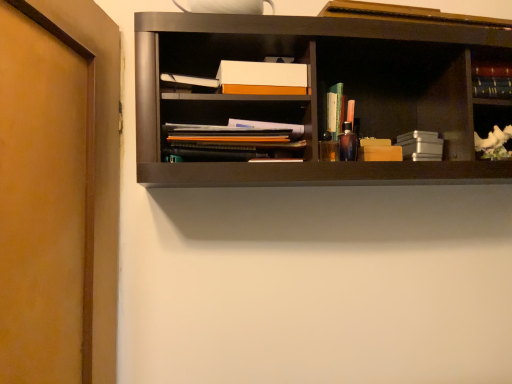
Question: From a real-world perspective, relative to translucent plastic pen holder at center, the second book positioned from the left, is matte black notebook at center, which is counted as the 1th book, starting from the left, vertically above or below?

Choices:
 (A) below
 (B) above

Answer: (A)

Question: Considering the positions of matte black notebook at center, which is counted as the 1th book, starting from the left, and translucent plastic pen holder at center, which appears as the 3th book when viewed from the right, in the image, is matte black notebook at center, which is counted as the 1th book, starting from the left, wider or thinner than translucent plastic pen holder at center, which appears as the 3th book when viewed from the right,?

Choices:
 (A) thin
 (B) wide

Answer: (B)

Question: Estimate the real-world distances between objects in this image. Which object is farther from the metallic silver book at center-right, the third book positioned from the left?

Choices:
 (A) white porcelain vase at right
 (B) brown matte door at left
 (C) matte black notebook at center, which is counted as the 1th book, starting from the left
 (D) translucent plastic pen holder at center, the second book positioned from the left
 (E) hardcover book at upper right, which appears as the first book when viewed from the right

Answer: (B)

Question: Which object is positioned farthest from the matte black notebook at center, which is counted as the 1th book, starting from the left?

Choices:
 (A) brown matte door at left
 (B) hardcover book at upper right, which appears as the fourth book when viewed from the left
 (C) translucent plastic pen holder at center, the second book positioned from the left
 (D) white porcelain vase at right
 (E) metallic silver book at center-right, acting as the second book starting from the right

Answer: (D)